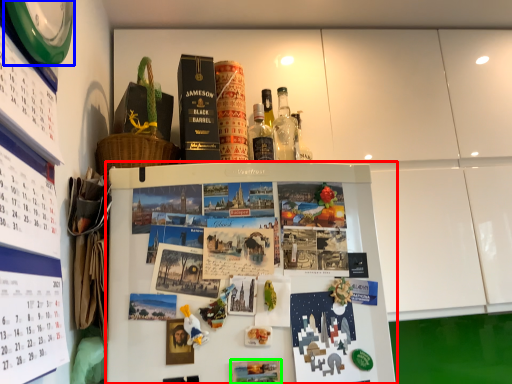
Question: Which is nearer to the refrigerator (highlighted by a red box)? clock (highlighted by a blue box) or book cover (highlighted by a green box).

Choices:
 (A) clock
 (B) book cover

Answer: (B)